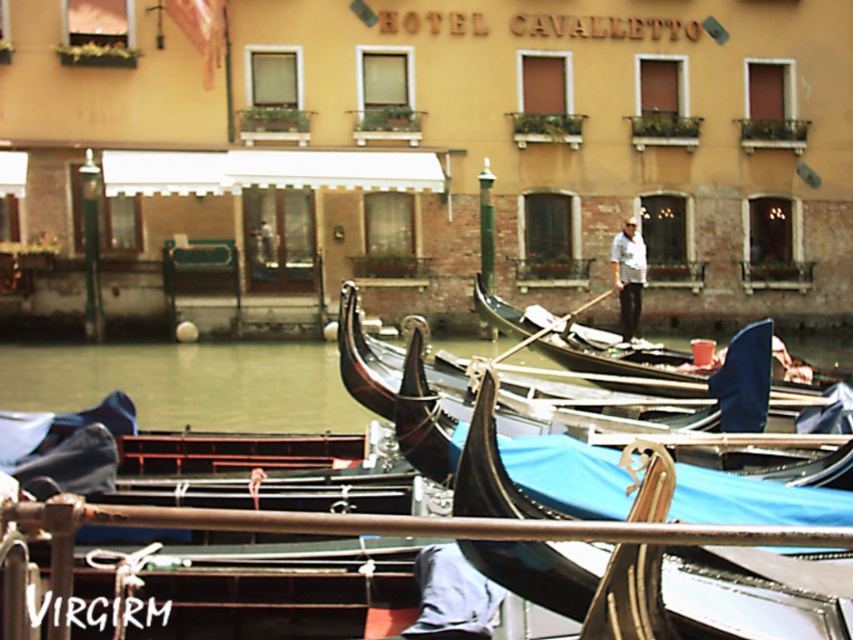
Question: Among these objects, which one is nearest to the camera?

Choices:
 (A) white cotton shirt at center
 (B) black polished gondola at center
 (C) wooden gondola at center

Answer: (C)

Question: Which of the following is the farthest from the observer?

Choices:
 (A) (628, 275)
 (B) (474, 294)
 (C) (833, 436)

Answer: (A)

Question: Is the position of wooden gondola at center more distant than that of black polished gondola at center?

Choices:
 (A) no
 (B) yes

Answer: (A)

Question: Does wooden gondola at center appear on the right side of black polished gondola at center?

Choices:
 (A) no
 (B) yes

Answer: (A)

Question: Which point is farther to the camera?

Choices:
 (A) (699, 449)
 (B) (618, 276)

Answer: (B)

Question: Can you confirm if wooden gondola at center is wider than white cotton shirt at center?

Choices:
 (A) yes
 (B) no

Answer: (A)